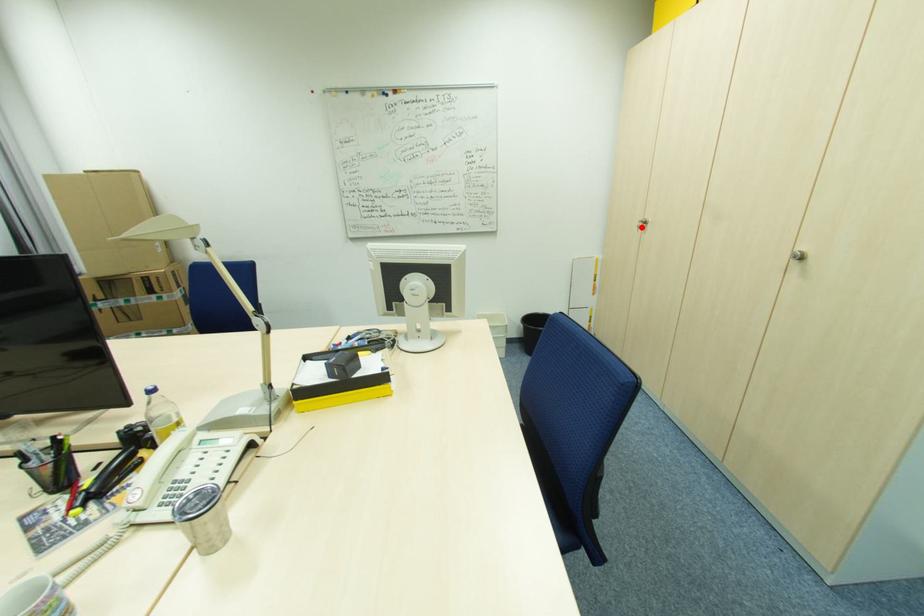
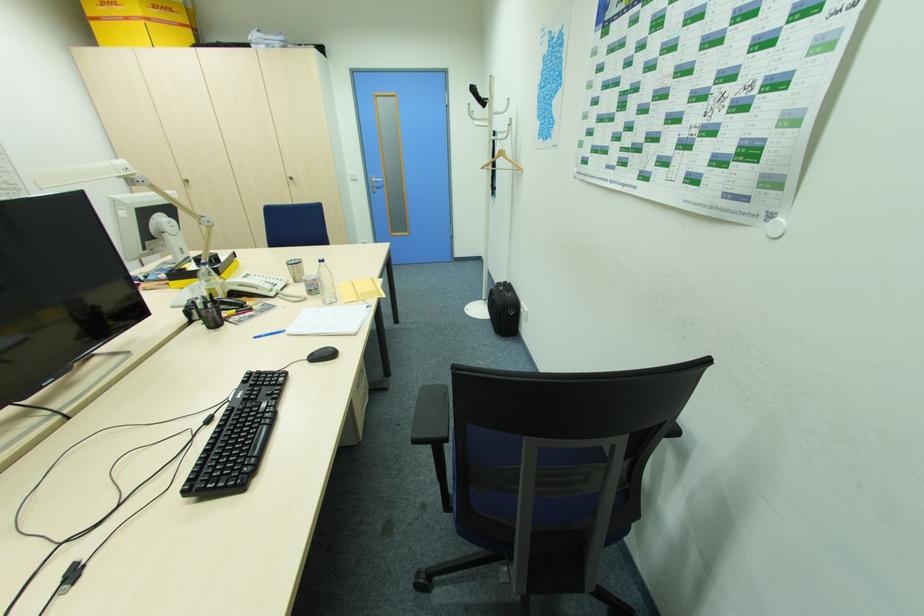
Where in the second image is the point corresponding to the highlighted location from the first image?

(188, 185)